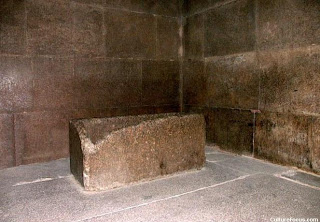
The height and width of the screenshot is (222, 320). In order to click on floor in this screenshot , I will do `click(120, 198)`.